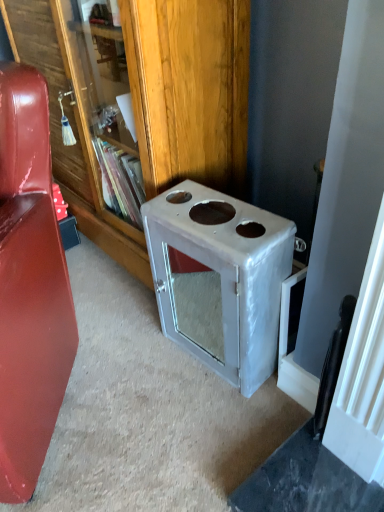
Question: Is metallic silver bookcase at center taller than glossy leather couch at left?

Choices:
 (A) yes
 (B) no

Answer: (A)

Question: Is metallic silver bookcase at center facing towards glossy leather couch at left?

Choices:
 (A) no
 (B) yes

Answer: (B)

Question: Is metallic silver bookcase at center smaller than glossy leather couch at left?

Choices:
 (A) no
 (B) yes

Answer: (A)

Question: Would you consider metallic silver bookcase at center to be distant from glossy leather couch at left?

Choices:
 (A) no
 (B) yes

Answer: (A)

Question: From a real-world perspective, is metallic silver bookcase at center positioned over glossy leather couch at left based on gravity?

Choices:
 (A) no
 (B) yes

Answer: (B)

Question: From a real-world perspective, is metallic silver bookcase at center physically located above or below white glossy stove at center?

Choices:
 (A) above
 (B) below

Answer: (A)

Question: Is metallic silver bookcase at center taller or shorter than white glossy stove at center?

Choices:
 (A) tall
 (B) short

Answer: (A)

Question: From the image's perspective, relative to white glossy stove at center, is metallic silver bookcase at center above or below?

Choices:
 (A) above
 (B) below

Answer: (A)

Question: Choose the correct answer: Is metallic silver bookcase at center inside white glossy stove at center or outside it?

Choices:
 (A) inside
 (B) outside

Answer: (B)

Question: In the image, is glossy leather couch at left positioned in front of or behind metallic silver bookcase at center?

Choices:
 (A) front
 (B) behind

Answer: (A)

Question: From the image's perspective, is glossy leather couch at left positioned above or below metallic silver bookcase at center?

Choices:
 (A) above
 (B) below

Answer: (B)

Question: Is glossy leather couch at left wider or thinner than metallic silver bookcase at center?

Choices:
 (A) thin
 (B) wide

Answer: (B)

Question: From a real-world perspective, is glossy leather couch at left positioned above or below metallic silver bookcase at center?

Choices:
 (A) below
 (B) above

Answer: (A)

Question: Choose the correct answer: Is metallic silver bookcase at center inside glossy leather couch at left or outside it?

Choices:
 (A) outside
 (B) inside

Answer: (A)

Question: Considering the positions of metallic silver bookcase at center and glossy leather couch at left in the image, is metallic silver bookcase at center bigger or smaller than glossy leather couch at left?

Choices:
 (A) small
 (B) big

Answer: (B)